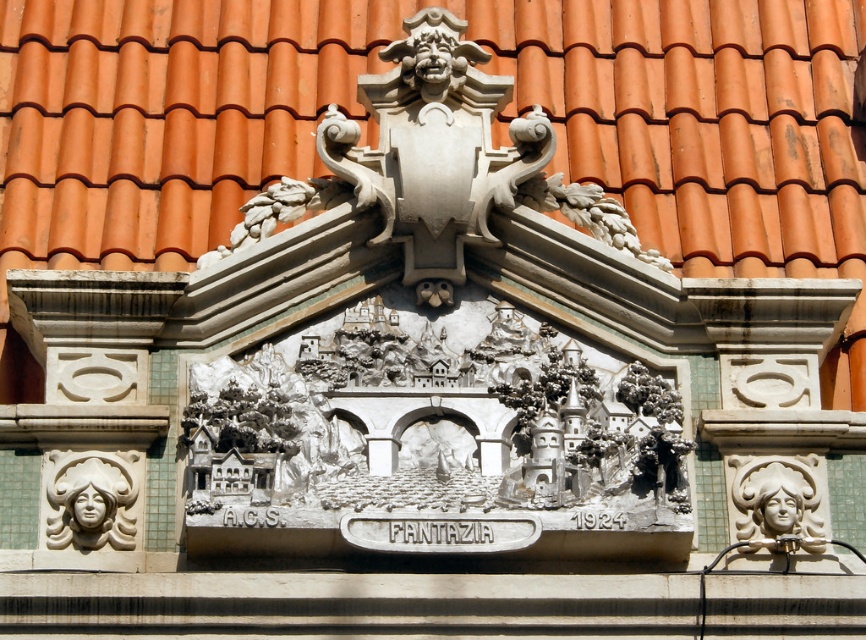
Question: Which object appears closest to the camera in this image?

Choices:
 (A) white glossy sculpture at right
 (B) orange clay tiles at center

Answer: (A)

Question: Is orange clay tiles at center positioned behind white glossy sculpture at right?

Choices:
 (A) yes
 (B) no

Answer: (A)

Question: Is white stone face at center wider than white glossy sculpture at right?

Choices:
 (A) yes
 (B) no

Answer: (B)

Question: Can you confirm if orange clay tiles at center is positioned above white stone face at center?

Choices:
 (A) yes
 (B) no

Answer: (A)

Question: Which of these objects is positioned farthest from the white stone face at center?

Choices:
 (A) orange clay tiles at center
 (B) white glossy sculpture at right

Answer: (A)

Question: Estimate the real-world distances between objects in this image. Which object is farther from the orange clay tiles at center?

Choices:
 (A) white glossy sculpture at right
 (B) white stone face at center

Answer: (A)